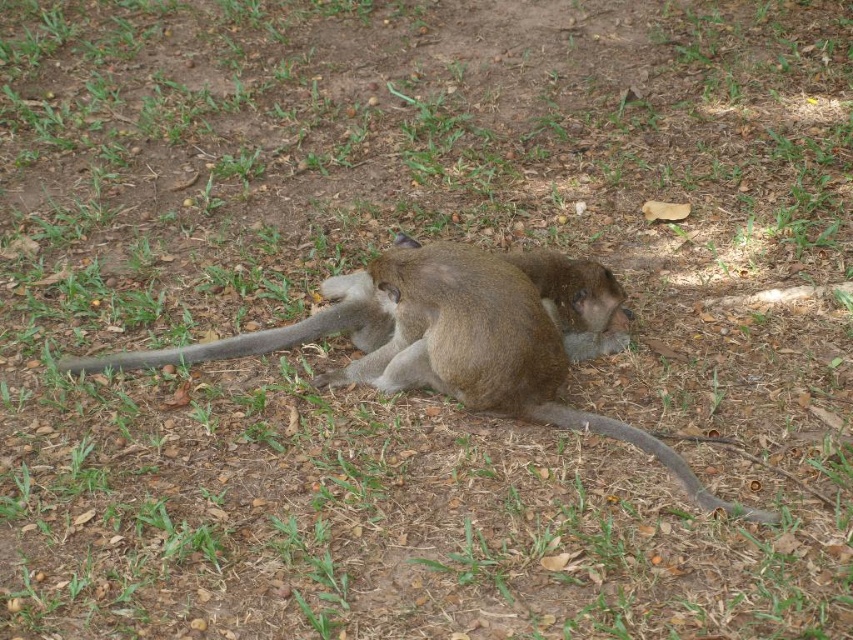
Question: Is gray matte tail at center bigger than brown fur tail at lower center?

Choices:
 (A) no
 (B) yes

Answer: (B)

Question: Which of these objects is positioned closest to the gray matte tail at center?

Choices:
 (A) brown fur tail at lower center
 (B) brown furry monkey at center

Answer: (B)

Question: Is brown furry monkey at center below brown fur tail at lower center?

Choices:
 (A) no
 (B) yes

Answer: (A)

Question: Among these points, which one is nearest to the camera?

Choices:
 (A) (595, 429)
 (B) (427, 310)
 (C) (97, 360)

Answer: (B)

Question: Can you confirm if brown furry monkey at center is thinner than brown fur tail at lower center?

Choices:
 (A) no
 (B) yes

Answer: (A)

Question: Which object is positioned farthest from the gray matte tail at center?

Choices:
 (A) brown furry monkey at center
 (B) brown fur tail at lower center

Answer: (B)